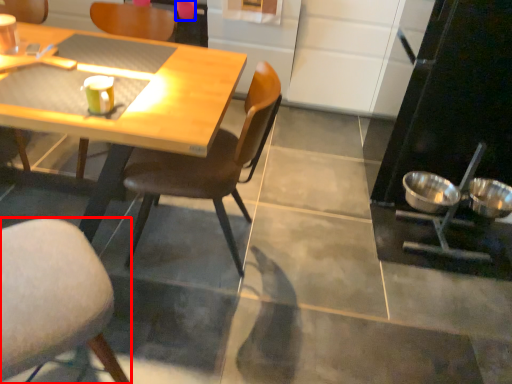
Question: Among these objects, which one is farthest to the camera, chair (highlighted by a red box) or coffee cup (highlighted by a blue box)?

Choices:
 (A) chair
 (B) coffee cup

Answer: (B)